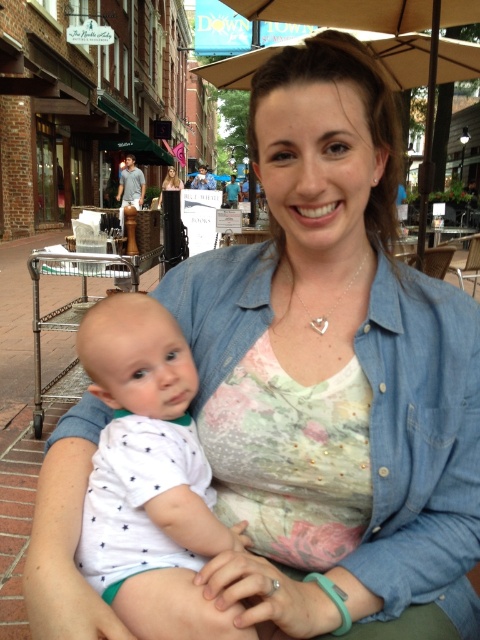
Question: Is denim shirt at center below white soft fabric baby at center?

Choices:
 (A) no
 (B) yes

Answer: (A)

Question: Which object is the farthest from the beige fabric umbrella at upper center?

Choices:
 (A) white soft fabric baby at center
 (B) denim shirt at center

Answer: (A)

Question: Considering the real-world distances, which object is farthest from the beige fabric umbrella at upper center?

Choices:
 (A) white soft fabric baby at center
 (B) denim shirt at center

Answer: (A)

Question: Which object is the closest to the white soft fabric baby at center?

Choices:
 (A) denim shirt at center
 (B) beige fabric umbrella at upper center

Answer: (A)

Question: Is denim shirt at center behind beige fabric umbrella at upper center?

Choices:
 (A) no
 (B) yes

Answer: (A)

Question: Is white soft fabric baby at center to the right of beige fabric umbrella at upper center from the viewer's perspective?

Choices:
 (A) no
 (B) yes

Answer: (A)